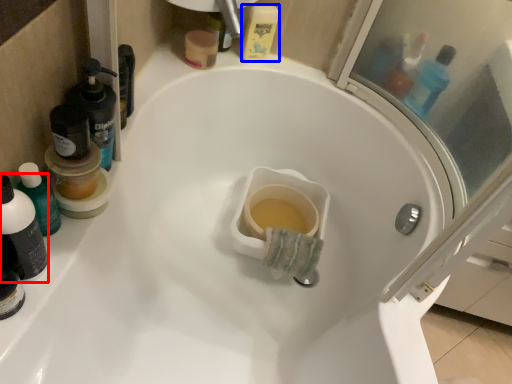
Question: Which of the following is the closest to the observer, mouthwash (highlighted by a red box) or mouthwash (highlighted by a blue box)?

Choices:
 (A) mouthwash
 (B) mouthwash

Answer: (A)